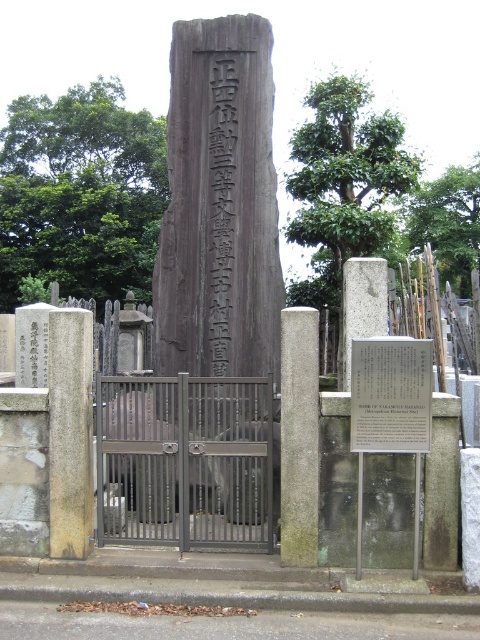
Who is more forward, [238,284] or [398,339]?

Positioned in front is point [398,339].

Locate an element on the screen. dark brown wood at center is located at coordinates (219, 205).

Between point (269, 397) and point (427, 426), which one is positioned in front?

Positioned in front is point (427, 426).

Between metallic gate at center and metallic plaque at center, which one is positioned lower?

metallic gate at center is lower down.

Which is in front, point (205, 545) or point (393, 401)?

Positioned in front is point (393, 401).

Find the location of a particular element. This screenshot has width=480, height=640. metallic gate at center is located at coordinates (184, 460).

Can you confirm if dark brown wood at center is thinner than gray stone pillar at left?

Incorrect, dark brown wood at center's width is not less than gray stone pillar at left's.

Can you confirm if dark brown wood at center is taller than gray stone pillar at left?

Correct, dark brown wood at center is much taller as gray stone pillar at left.

Measure the distance between dark brown wood at center and camera.

dark brown wood at center is 6.87 meters from camera.

Locate an element on the screen. dark brown wood at center is located at coordinates (219, 205).